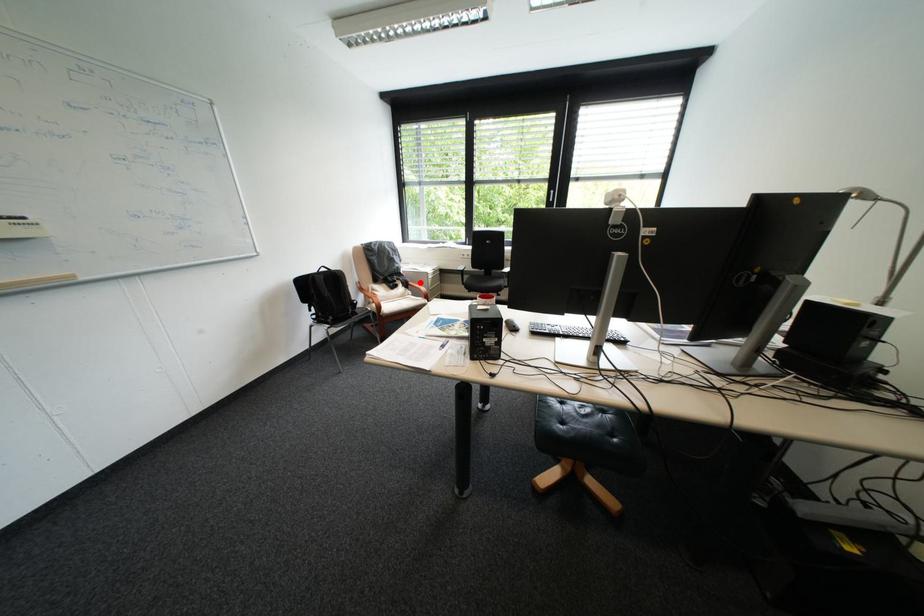
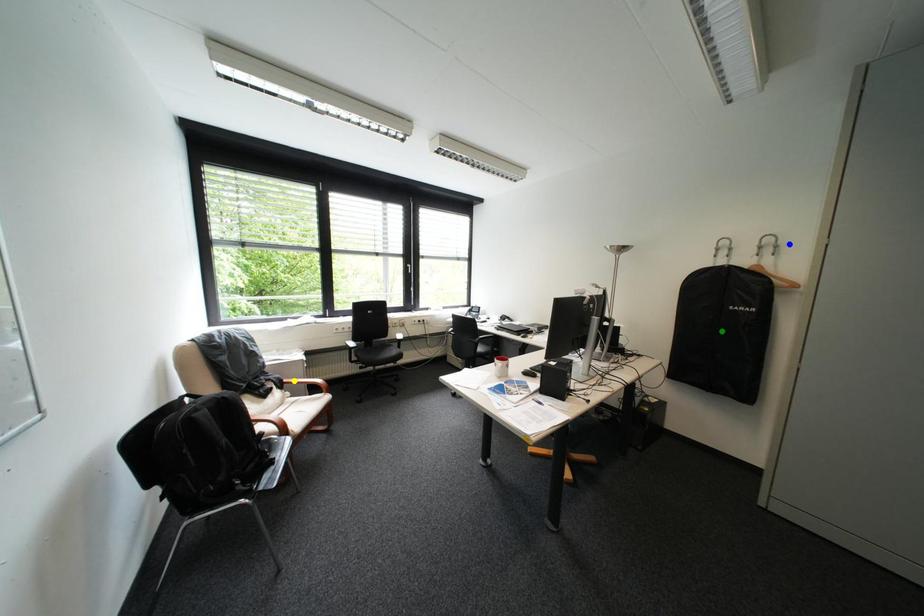
Question: I am providing you with two images of the same scene from different viewpoints. A red point is marked on the first image. You are given multiple points on the second image. Which point in image 2 represents the same 3d spot as the red point in image 1?

Choices:
 (A) yellow point
 (B) blue point
 (C) green point

Answer: (A)